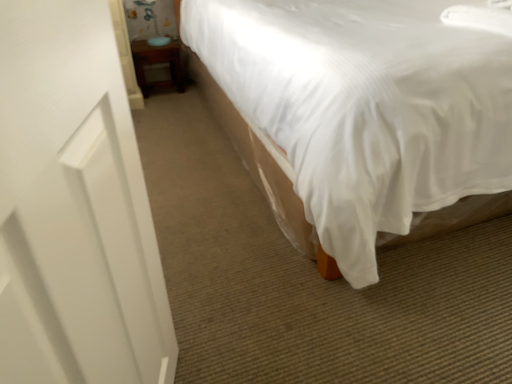
Question: Considering the positions of point (459, 172) and point (179, 87), is point (459, 172) closer or farther from the camera than point (179, 87)?

Choices:
 (A) farther
 (B) closer

Answer: (B)

Question: Is white fabric bed at center spatially inside wooden table at lower left, or outside of it?

Choices:
 (A) inside
 (B) outside

Answer: (B)

Question: Which object is positioned closest to the white matte screen door at left?

Choices:
 (A) white fabric bed at center
 (B) wooden table at lower left

Answer: (A)

Question: Estimate the real-world distances between objects in this image. Which object is closer to the white matte screen door at left?

Choices:
 (A) wooden table at lower left
 (B) white fabric bed at center

Answer: (B)